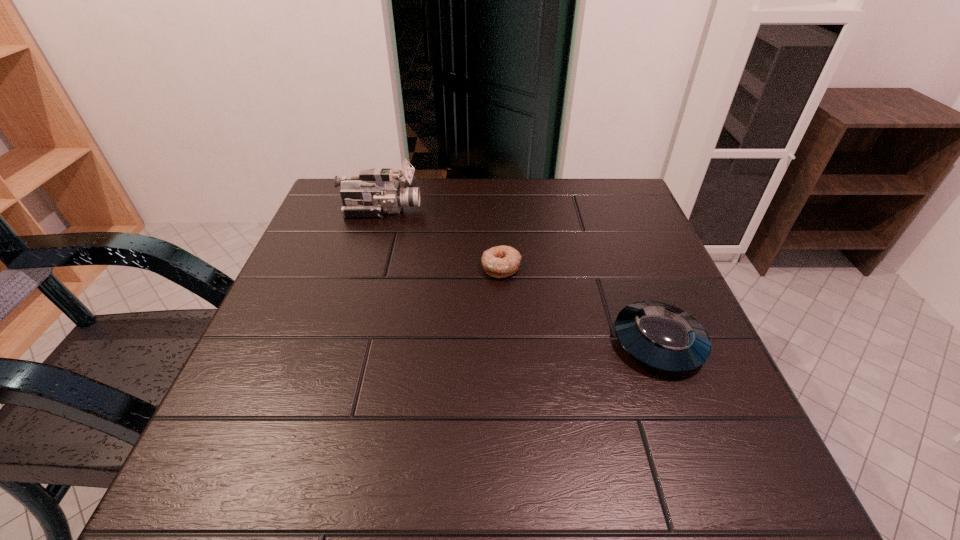
At what (x,y) coordinates should I click in order to perform the action: click on free space between the leftmost object and the second tallest object. Please return your answer as a coordinate pair (x, y). The height and width of the screenshot is (540, 960). Looking at the image, I should click on (519, 276).

Image resolution: width=960 pixels, height=540 pixels. What are the coordinates of `free space between the leftmost object and the rightmost object` in the screenshot? It's located at (519, 276).

Find the location of a particular element. This screenshot has height=540, width=960. vacant space that is in between the second tallest object and the leftmost object is located at coordinates (519, 276).

Find the location of a particular element. free space between the farthest object and the second object from right to left is located at coordinates (442, 238).

I want to click on empty space between the second object from right to left and the nearest object, so click(x=580, y=305).

Where is `empty location between the camcorder and the shortest object`? The width and height of the screenshot is (960, 540). empty location between the camcorder and the shortest object is located at coordinates (442, 238).

Find the location of a particular element. The height and width of the screenshot is (540, 960). vacant space that is in between the leftmost object and the doughnut is located at coordinates (442, 238).

Locate an element on the screen. The width and height of the screenshot is (960, 540). vacant space that is in between the tallest object and the rightmost object is located at coordinates (519, 276).

Select which object is the closest to the farthest object. Please provide its 2D coordinates. Your answer should be formatted as a tuple, i.e. [(x, y)], where the tuple contains the x and y coordinates of a point satisfying the conditions above.

[(502, 261)]

Point out which object is positioned as the second nearest to the doughnut. Please provide its 2D coordinates. Your answer should be formatted as a tuple, i.e. [(x, y)], where the tuple contains the x and y coordinates of a point satisfying the conditions above.

[(375, 192)]